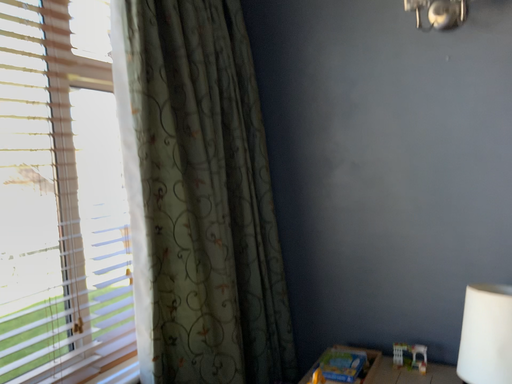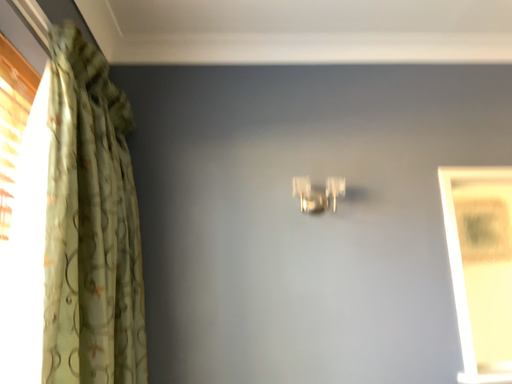
Question: Which way did the camera rotate in the video?

Choices:
 (A) rotated upward
 (B) rotated downward

Answer: (A)